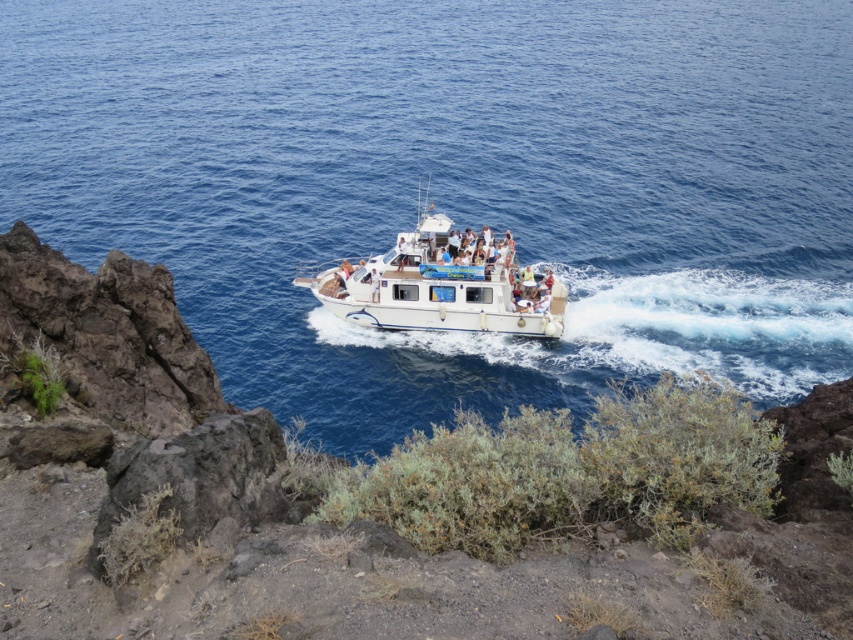
You are standing on the volcanic rocks and want to take a photo of the white glossy boat at center and the blue water at center. Which object will appear larger in your photo?

The blue water at center will appear larger in the photo because it is closer to the viewer than the white glossy boat at center.